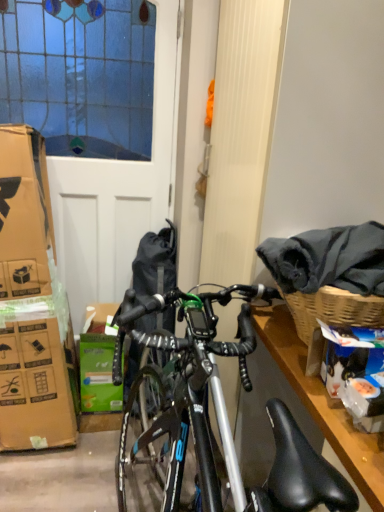
Question: Is green cardboard box at center facing away from white matte screen door at left?

Choices:
 (A) no
 (B) yes

Answer: (B)

Question: From the image's perspective, is green cardboard box at center below white matte screen door at left?

Choices:
 (A) no
 (B) yes

Answer: (B)

Question: Considering the relative positions of green cardboard box at center and white matte screen door at left in the image provided, is green cardboard box at center behind white matte screen door at left?

Choices:
 (A) yes
 (B) no

Answer: (A)

Question: Considering the relative sizes of green cardboard box at center and white matte screen door at left in the image provided, is green cardboard box at center bigger than white matte screen door at left?

Choices:
 (A) no
 (B) yes

Answer: (A)

Question: Is green cardboard box at center taller than white matte screen door at left?

Choices:
 (A) no
 (B) yes

Answer: (A)

Question: Does green cardboard box at center have a lesser height compared to white matte screen door at left?

Choices:
 (A) yes
 (B) no

Answer: (A)

Question: Is white matte screen door at left behind green cardboard box at center?

Choices:
 (A) no
 (B) yes

Answer: (A)

Question: From a real-world perspective, does white matte screen door at left sit lower than green cardboard box at center?

Choices:
 (A) yes
 (B) no

Answer: (B)

Question: Is white matte screen door at left positioned with its back to green cardboard box at center?

Choices:
 (A) yes
 (B) no

Answer: (A)

Question: Can you see white matte screen door at left touching green cardboard box at center?

Choices:
 (A) yes
 (B) no

Answer: (B)

Question: From the image's perspective, is white matte screen door at left under green cardboard box at center?

Choices:
 (A) yes
 (B) no

Answer: (B)

Question: Does white matte screen door at left have a greater height compared to green cardboard box at center?

Choices:
 (A) no
 (B) yes

Answer: (B)

Question: Relative to white matte screen door at left, is green cardboard box at center in front or behind?

Choices:
 (A) front
 (B) behind

Answer: (B)